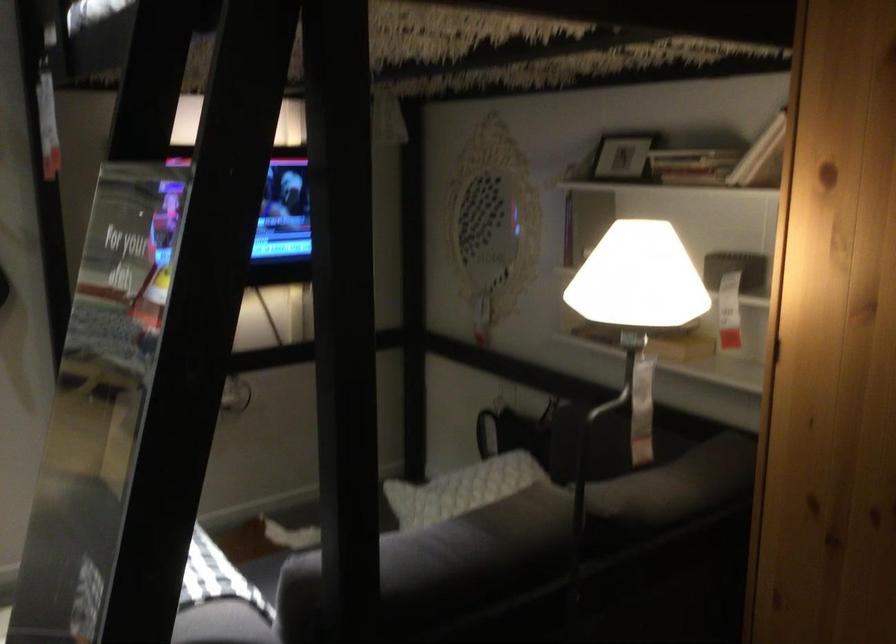
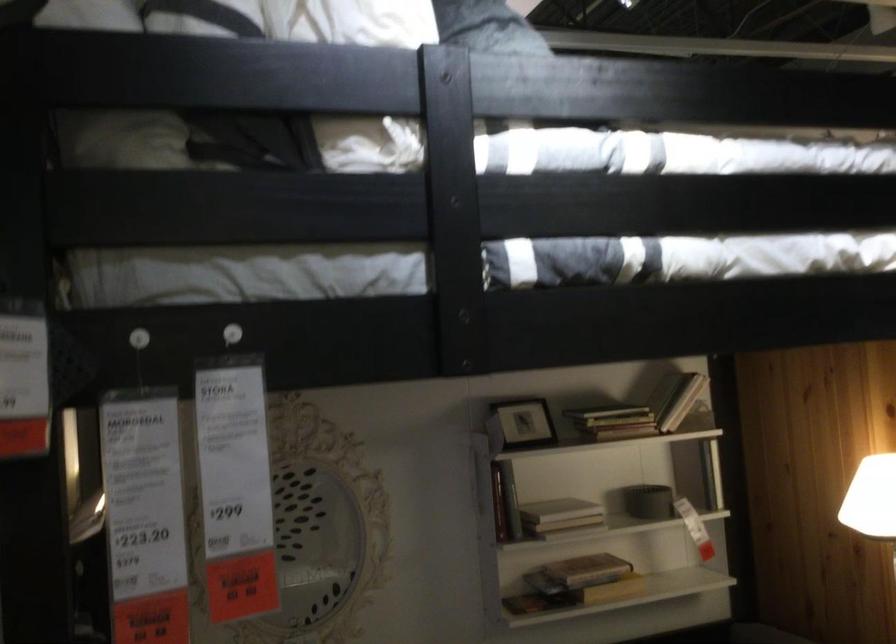
Find the pixel in the second image that matches [607,158] in the first image.

(522, 422)